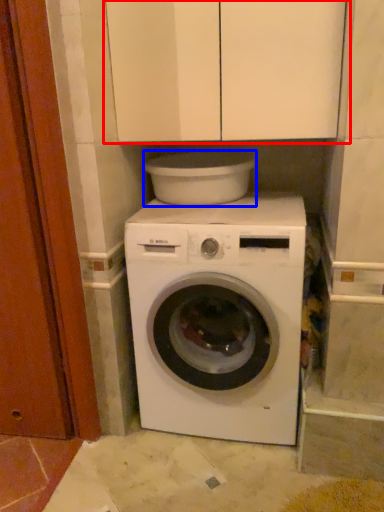
Question: Which of the following is the farthest to the observer, cabinetry (highlighted by a red box) or appliance (highlighted by a blue box)?

Choices:
 (A) cabinetry
 (B) appliance

Answer: (B)